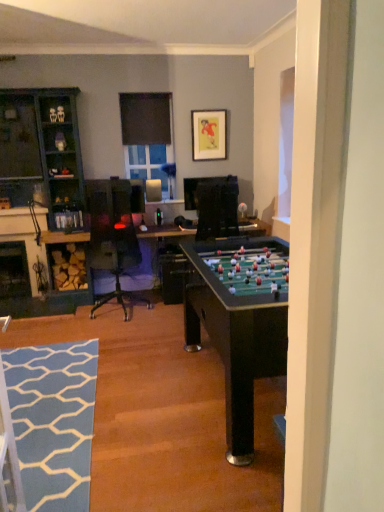
This screenshot has height=512, width=384. I want to click on matte black picture frame at upper center, so click(x=209, y=135).

Describe the element at coordinates (209, 135) in the screenshot. I see `matte black picture frame at upper center` at that location.

Image resolution: width=384 pixels, height=512 pixels. What do you see at coordinates (14, 280) in the screenshot?
I see `black glass fireplace at lower left` at bounding box center [14, 280].

I want to click on black glass fireplace at lower left, so click(x=14, y=280).

What is the approximate height of clear glass window at upper center, which is the first window screen in bottom-to-top order?

26.32 inches.

At what (x,y) coordinates should I click in order to perform the action: click on black matte window screen at upper center, the 1th window screen viewed from the top. Please return your answer as a coordinate pair (x, y). Looking at the image, I should click on (145, 118).

Is blue textured rug at lower left at the left side of black matte window screen at upper center, the 1th window screen viewed from the top?

Yes, blue textured rug at lower left is to the left of black matte window screen at upper center, the 1th window screen viewed from the top.

Is blue textured rug at lower left aimed at black matte window screen at upper center, which is counted as the 2th window screen, starting from the bottom?

No, blue textured rug at lower left is not oriented towards black matte window screen at upper center, which is counted as the 2th window screen, starting from the bottom.

Who is bigger, blue textured rug at lower left or black matte window screen at upper center, the 1th window screen viewed from the top?

blue textured rug at lower left is bigger.

Is blue textured rug at lower left spatially inside black matte window screen at upper center, which is counted as the 2th window screen, starting from the bottom, or outside of it?

blue textured rug at lower left is spatially situated outside black matte window screen at upper center, which is counted as the 2th window screen, starting from the bottom.

Is matte black picture frame at upper center at the back of clear glass window at upper center, the 2th window screen when ordered from top to bottom?

No, clear glass window at upper center, the 2th window screen when ordered from top to bottom, is not facing the opposite direction of matte black picture frame at upper center.

Where is `picture frame on the right of the clear glass window at upper center, the 2th window screen when ordered from top to bottom`? The image size is (384, 512). picture frame on the right of the clear glass window at upper center, the 2th window screen when ordered from top to bottom is located at coordinates (209, 135).

Is clear glass window at upper center, the 2th window screen when ordered from top to bottom, in front of or behind matte black picture frame at upper center in the image?

Clearly, clear glass window at upper center, the 2th window screen when ordered from top to bottom, is behind matte black picture frame at upper center.

From the picture: Which is farther from the camera, (160, 153) or (193, 136)?

Positioned behind is point (160, 153).

Does teal wood cabinet at left have a greater width compared to black matte window screen at upper center, the 1th window screen viewed from the top?

Correct, the width of teal wood cabinet at left exceeds that of black matte window screen at upper center, the 1th window screen viewed from the top.

Is point (60, 152) closer or farther from the camera than point (137, 99)?

Point (60, 152) is closer to the camera than point (137, 99).

Is teal wood cabinet at left completely or partially outside of black matte window screen at upper center, which is counted as the 2th window screen, starting from the bottom?

teal wood cabinet at left lies outside black matte window screen at upper center, which is counted as the 2th window screen, starting from the bottom,'s area.

Based on their positions, is teal wood cabinet at left located to the left or right of black matte window screen at upper center, which is counted as the 2th window screen, starting from the bottom?

teal wood cabinet at left is positioned on black matte window screen at upper center, which is counted as the 2th window screen, starting from the bottom,'s left side.

Is black matte window screen at upper center, the 1th window screen viewed from the top, oriented towards matte black picture frame at upper center?

No.

From the image's perspective, is black matte window screen at upper center, which is counted as the 2th window screen, starting from the bottom, under matte black picture frame at upper center?

No.

Is black matte window screen at upper center, which is counted as the 2th window screen, starting from the bottom, wider than matte black picture frame at upper center?

Yes, black matte window screen at upper center, which is counted as the 2th window screen, starting from the bottom, is wider than matte black picture frame at upper center.

Relative to matte black picture frame at upper center, is black matte window screen at upper center, which is counted as the 2th window screen, starting from the bottom, in front or behind?

Clearly, black matte window screen at upper center, which is counted as the 2th window screen, starting from the bottom, is behind matte black picture frame at upper center.

Can you confirm if clear glass window at upper center, the 2th window screen when ordered from top to bottom, is bigger than teal wood cabinet at left?

No, clear glass window at upper center, the 2th window screen when ordered from top to bottom, is not bigger than teal wood cabinet at left.

Considering the positions of objects clear glass window at upper center, which is the first window screen in bottom-to-top order, and teal wood cabinet at left in the image provided, who is behind, clear glass window at upper center, which is the first window screen in bottom-to-top order, or teal wood cabinet at left?

clear glass window at upper center, which is the first window screen in bottom-to-top order, is further away from the camera.

Is point (139, 167) closer to camera compared to point (14, 191)?

No, it is not.

Can you tell me how much clear glass window at upper center, which is the first window screen in bottom-to-top order, and teal wood cabinet at left differ in facing direction?

0.00146 degrees separate the facing orientations of clear glass window at upper center, which is the first window screen in bottom-to-top order, and teal wood cabinet at left.

Can you confirm if black matte window screen at upper center, which is counted as the 2th window screen, starting from the bottom, is positioned to the left of clear glass window at upper center, the 2th window screen when ordered from top to bottom?

Indeed, black matte window screen at upper center, which is counted as the 2th window screen, starting from the bottom, is positioned on the left side of clear glass window at upper center, the 2th window screen when ordered from top to bottom.

Is clear glass window at upper center, the 2th window screen when ordered from top to bottom, completely or partially inside black matte window screen at upper center, the 1th window screen viewed from the top?

No, clear glass window at upper center, the 2th window screen when ordered from top to bottom, is located outside of black matte window screen at upper center, the 1th window screen viewed from the top.

Is black matte window screen at upper center, which is counted as the 2th window screen, starting from the bottom, in contact with clear glass window at upper center, which is the first window screen in bottom-to-top order?

No, black matte window screen at upper center, which is counted as the 2th window screen, starting from the bottom, is not touching clear glass window at upper center, which is the first window screen in bottom-to-top order.

Where is `window screen that is above the clear glass window at upper center, the 2th window screen when ordered from top to bottom (from a real-world perspective)`? The width and height of the screenshot is (384, 512). window screen that is above the clear glass window at upper center, the 2th window screen when ordered from top to bottom (from a real-world perspective) is located at coordinates (145, 118).

Is matte black picture frame at upper center bigger than black glass fireplace at lower left?

No.

From the image's perspective, is matte black picture frame at upper center located above or below black glass fireplace at lower left?

From the image's perspective, matte black picture frame at upper center appears above black glass fireplace at lower left.

Looking at this image, is black glass fireplace at lower left a part of matte black picture frame at upper center?

No, black glass fireplace at lower left is not inside matte black picture frame at upper center.

Where is `flat below the black matte window screen at upper center, which is counted as the 2th window screen, starting from the bottom (from a real-world perspective)`? The image size is (384, 512). flat below the black matte window screen at upper center, which is counted as the 2th window screen, starting from the bottom (from a real-world perspective) is located at coordinates (53, 421).

Where is `picture frame located above the clear glass window at upper center, which is the first window screen in bottom-to-top order (from the image's perspective)`? picture frame located above the clear glass window at upper center, which is the first window screen in bottom-to-top order (from the image's perspective) is located at coordinates pos(209,135).

Consider the image. Which object lies further to the anchor point teal wood cabinet at left, clear glass window at upper center, the 2th window screen when ordered from top to bottom, or blue textured rug at lower left?

The object further to teal wood cabinet at left is blue textured rug at lower left.

Which object lies nearer to the anchor point black glass fireplace at lower left, clear glass window at upper center, which is the first window screen in bottom-to-top order, or matte black picture frame at upper center?

Among the two, clear glass window at upper center, which is the first window screen in bottom-to-top order, is located nearer to black glass fireplace at lower left.

When comparing their distances from blue textured rug at lower left, does matte black picture frame at upper center or black matte window screen at upper center, the 1th window screen viewed from the top, seem closer?

Based on the image, black matte window screen at upper center, the 1th window screen viewed from the top, appears to be nearer to blue textured rug at lower left.

Looking at the image, which one is located further to blue textured rug at lower left, teal wood cabinet at left or clear glass window at upper center, the 2th window screen when ordered from top to bottom?

Among the two, clear glass window at upper center, the 2th window screen when ordered from top to bottom, is located further to blue textured rug at lower left.

Estimate the real-world distances between objects in this image. Which object is further from black matte window screen at upper center, the 1th window screen viewed from the top, matte black picture frame at upper center or clear glass window at upper center, which is the first window screen in bottom-to-top order?

matte black picture frame at upper center is positioned further to the anchor black matte window screen at upper center, the 1th window screen viewed from the top.

From the image, which object appears to be farther from black glass fireplace at lower left, black matte window screen at upper center, the 1th window screen viewed from the top, or matte black picture frame at upper center?

The object further to black glass fireplace at lower left is matte black picture frame at upper center.

Which object lies nearer to the anchor point teal wood cabinet at left, matte black picture frame at upper center or black matte window screen at upper center, which is counted as the 2th window screen, starting from the bottom?

black matte window screen at upper center, which is counted as the 2th window screen, starting from the bottom, lies closer to teal wood cabinet at left than the other object.

Which object lies further to the anchor point black glass fireplace at lower left, clear glass window at upper center, the 2th window screen when ordered from top to bottom, or black matte window screen at upper center, which is counted as the 2th window screen, starting from the bottom?

black matte window screen at upper center, which is counted as the 2th window screen, starting from the bottom.

Find the location of a particular element. This screenshot has width=384, height=512. picture frame positioned between blue textured rug at lower left and black matte window screen at upper center, the 1th window screen viewed from the top, from near to far is located at coordinates (209, 135).

Where is `window screen situated between teal wood cabinet at left and clear glass window at upper center, the 2th window screen when ordered from top to bottom, from left to right`? The width and height of the screenshot is (384, 512). window screen situated between teal wood cabinet at left and clear glass window at upper center, the 2th window screen when ordered from top to bottom, from left to right is located at coordinates (145, 118).

The width and height of the screenshot is (384, 512). What are the coordinates of `window screen between blue textured rug at lower left and clear glass window at upper center, the 2th window screen when ordered from top to bottom, from front to back` in the screenshot? It's located at (145, 118).

The width and height of the screenshot is (384, 512). I want to click on fireplace between blue textured rug at lower left and matte black picture frame at upper center from front to back, so click(14, 280).